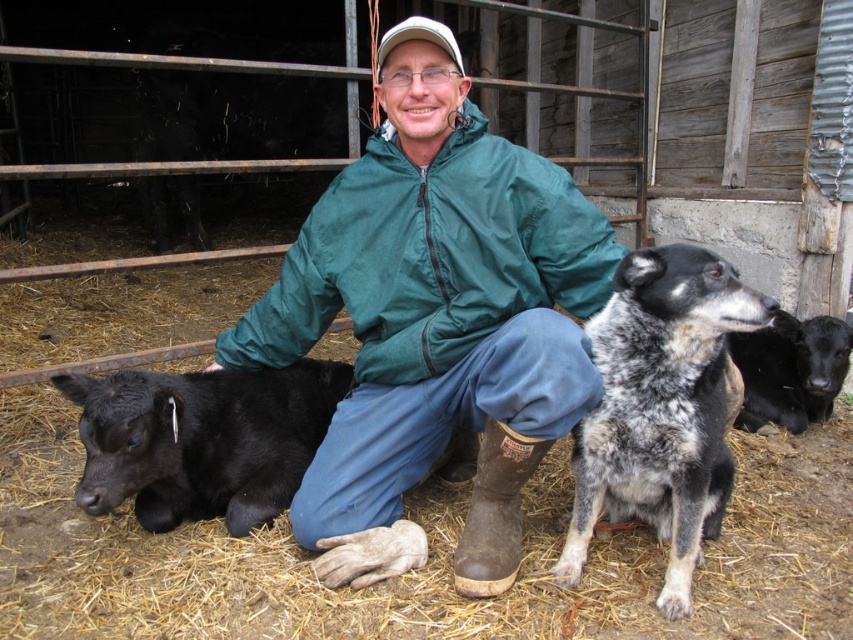
Can you confirm if spotted fur dog at center is positioned below black fur calf at lower left?

Indeed, spotted fur dog at center is positioned under black fur calf at lower left.

Is point (682, 324) closer to camera compared to point (784, 349)?

Yes.

Locate an element on the screen. This screenshot has width=853, height=640. spotted fur dog at center is located at coordinates [660, 408].

Locate an element on the screen. This screenshot has height=640, width=853. black smooth calf at lower left is located at coordinates (201, 440).

Describe the element at coordinates (201, 440) in the screenshot. I see `black smooth calf at lower left` at that location.

This screenshot has width=853, height=640. What do you see at coordinates (201, 440) in the screenshot? I see `black smooth calf at lower left` at bounding box center [201, 440].

Locate an element on the screen. The image size is (853, 640). black smooth calf at lower left is located at coordinates (201, 440).

Is green fabric jacket at center further to the viewer compared to spotted fur dog at center?

Yes, green fabric jacket at center is further from the viewer.

Does point (445, 310) lie behind point (614, 464)?

Yes, point (445, 310) is farther from viewer.

I want to click on green fabric jacket at center, so click(x=434, y=321).